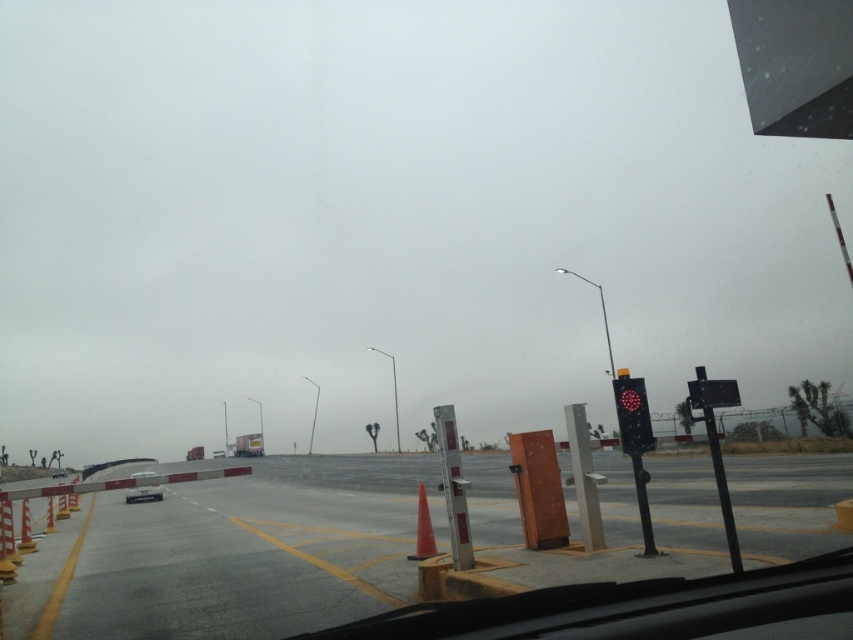
Does orange matte traffic cone at center appear under orange plastic traffic cone at left?

No.

Who is shorter, orange matte traffic cone at center or orange plastic traffic cone at left?

Standing shorter between the two is orange matte traffic cone at center.

Is point (430, 524) closer to camera compared to point (50, 529)?

Yes, point (430, 524) is in front of point (50, 529).

Locate an element on the screen. This screenshot has width=853, height=640. orange matte traffic cone at center is located at coordinates (422, 529).

Does white plastic car at center have a lesser width compared to orange matte traffic cone at left?

No, white plastic car at center is not thinner than orange matte traffic cone at left.

Can you confirm if white plastic car at center is shorter than orange matte traffic cone at left?

No, white plastic car at center is not shorter than orange matte traffic cone at left.

Who is more distant from viewer, (154, 492) or (24, 524)?

Positioned behind is point (154, 492).

At what (x,y) coordinates should I click in order to perform the action: click on white plastic car at center. Please return your answer as a coordinate pair (x, y). Looking at the image, I should click on (143, 493).

Looking at this image, can you confirm if transparent glass windshield at lower center is positioned to the right of black plastic traffic light at right?

In fact, transparent glass windshield at lower center is to the left of black plastic traffic light at right.

Is transparent glass windshield at lower center smaller than black plastic traffic light at right?

Yes, transparent glass windshield at lower center is smaller than black plastic traffic light at right.

Between point (844, 632) and point (730, 540), which one is positioned behind?

The point (730, 540) is behind.

What are the coordinates of `transparent glass windshield at lower center` in the screenshot? It's located at (641, 609).